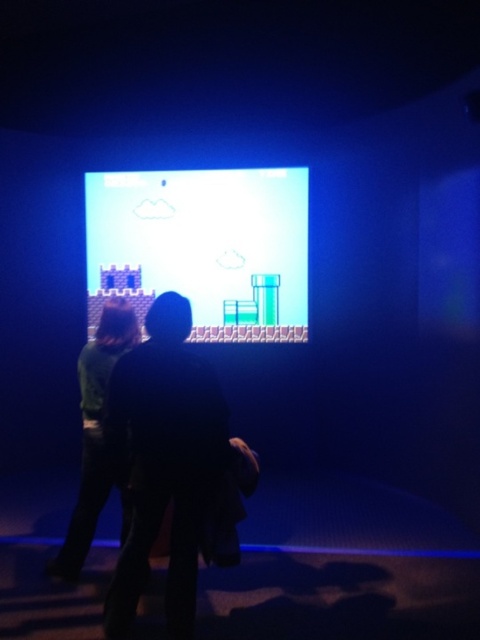
Can you confirm if dark fabric jacket at center is positioned to the right of green matte shirt at center?

Correct, you'll find dark fabric jacket at center to the right of green matte shirt at center.

How much distance is there between dark fabric jacket at center and green matte shirt at center?

They are 13.56 inches apart.

Is point (228, 428) more distant than point (64, 536)?

No, (228, 428) is closer to viewer.

This screenshot has height=640, width=480. What are the coordinates of `dark fabric jacket at center` in the screenshot? It's located at (167, 460).

Does pixelated video game at center have a greater width compared to dark fabric jacket at center?

Yes, pixelated video game at center is wider than dark fabric jacket at center.

Is pixelated video game at center below dark fabric jacket at center?

No.

What do you see at coordinates (204, 248) in the screenshot? The image size is (480, 640). I see `pixelated video game at center` at bounding box center [204, 248].

I want to click on pixelated video game at center, so click(x=204, y=248).

Is pixelated video game at center further to camera compared to green matte shirt at center?

That is True.

The height and width of the screenshot is (640, 480). Identify the location of pixelated video game at center. (204, 248).

Is point (276, 305) farther from viewer compared to point (120, 300)?

Yes, it is.

Where is `pixelated video game at center`? pixelated video game at center is located at coordinates (204, 248).